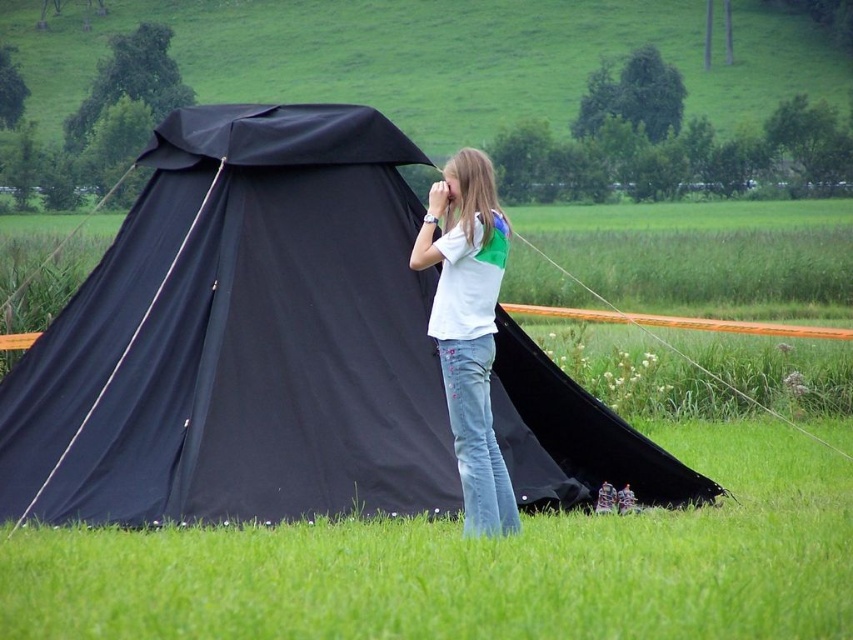
Question: Does black fabric tent at center appear under white cotton shirt at center?

Choices:
 (A) no
 (B) yes

Answer: (A)

Question: Is black fabric tent at center wider than white cotton shirt at center?

Choices:
 (A) yes
 (B) no

Answer: (A)

Question: Which of the following is the closest to the observer?

Choices:
 (A) black fabric tent at center
 (B) white cotton shirt at center

Answer: (B)

Question: Can you confirm if black fabric tent at center is smaller than white cotton shirt at center?

Choices:
 (A) no
 (B) yes

Answer: (A)